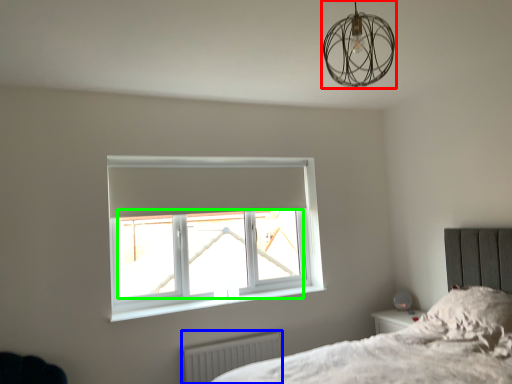
Question: Which is farther away from lamp (highlighted by a red box)? radiator (highlighted by a blue box) or window screen (highlighted by a green box)?

Choices:
 (A) radiator
 (B) window screen

Answer: (A)